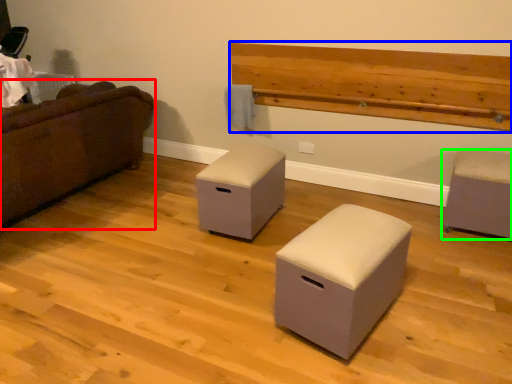
Question: Which object is the farthest from studio couch (highlighted by a red box)? Choose among these: hardwood (highlighted by a blue box) or furniture (highlighted by a green box).

Choices:
 (A) hardwood
 (B) furniture

Answer: (B)